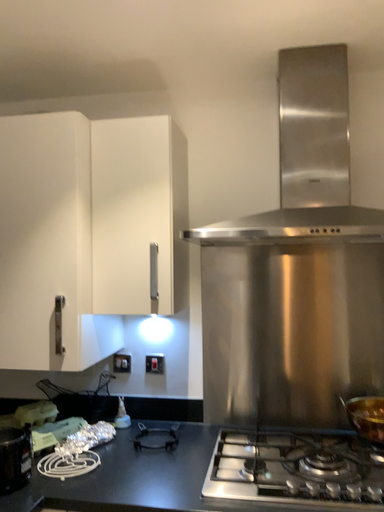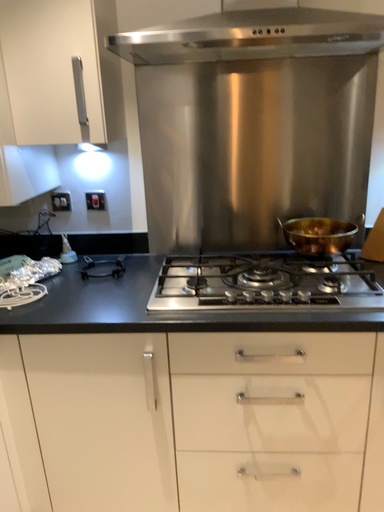
Question: How did the camera likely rotate when shooting the video?

Choices:
 (A) rotated right
 (B) rotated left

Answer: (A)